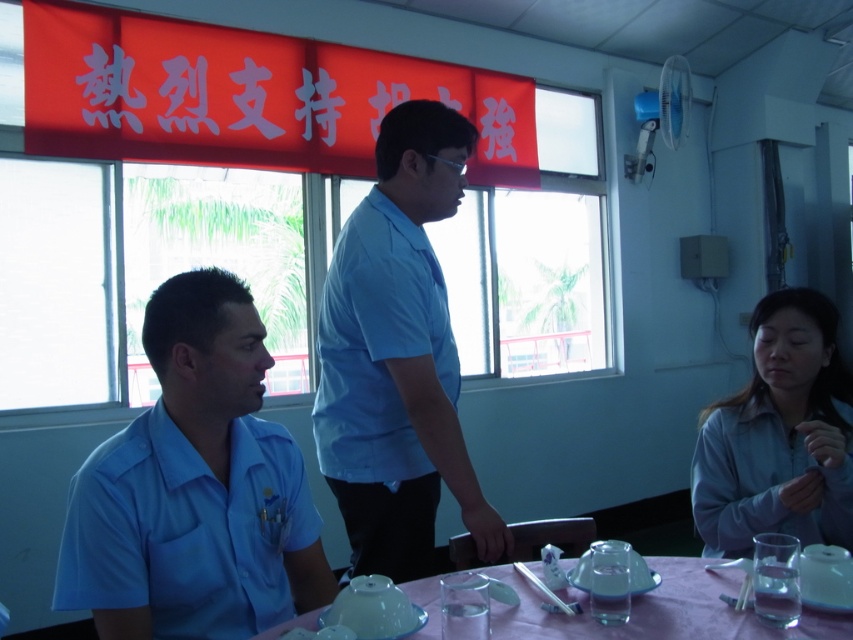
Question: Can you confirm if matte blue shirt at left is positioned to the left of pink plastic table at lower center?

Choices:
 (A) no
 (B) yes

Answer: (B)

Question: Which object is closer to the camera taking this photo?

Choices:
 (A) matte blue shirt at left
 (B) light blue shirt at center

Answer: (A)

Question: Is matte blue shirt at left smaller than light blue fabric shirt at lower right?

Choices:
 (A) no
 (B) yes

Answer: (B)

Question: Which point is farther to the camera?

Choices:
 (A) light blue shirt at center
 (B) light blue fabric shirt at lower right
 (C) matte blue shirt at left
 (D) pink plastic table at lower center

Answer: (A)

Question: Can you confirm if light blue shirt at center is wider than pink plastic table at lower center?

Choices:
 (A) yes
 (B) no

Answer: (B)

Question: Which point is closer to the camera taking this photo?

Choices:
 (A) (161, 378)
 (B) (463, 497)
 (C) (788, 356)
 (D) (815, 625)

Answer: (D)